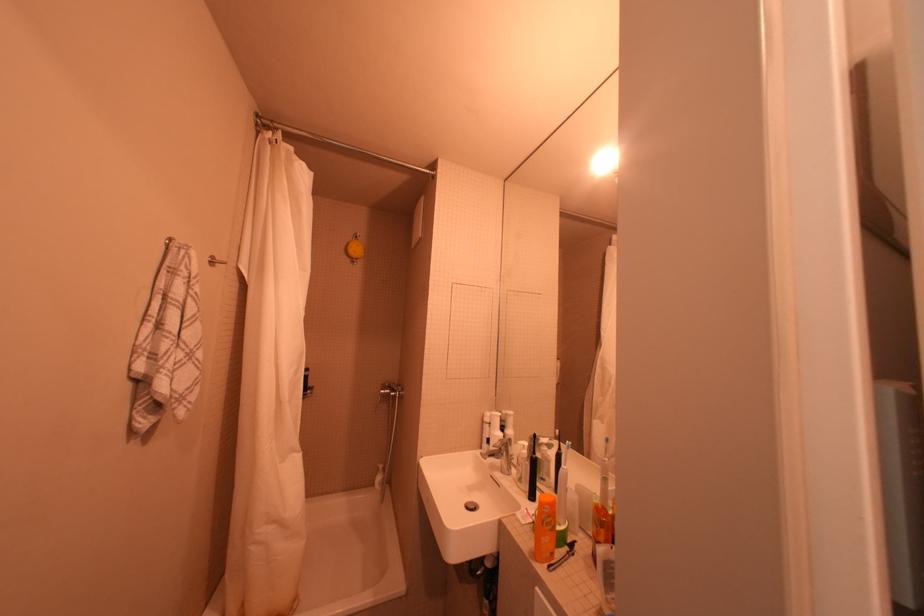
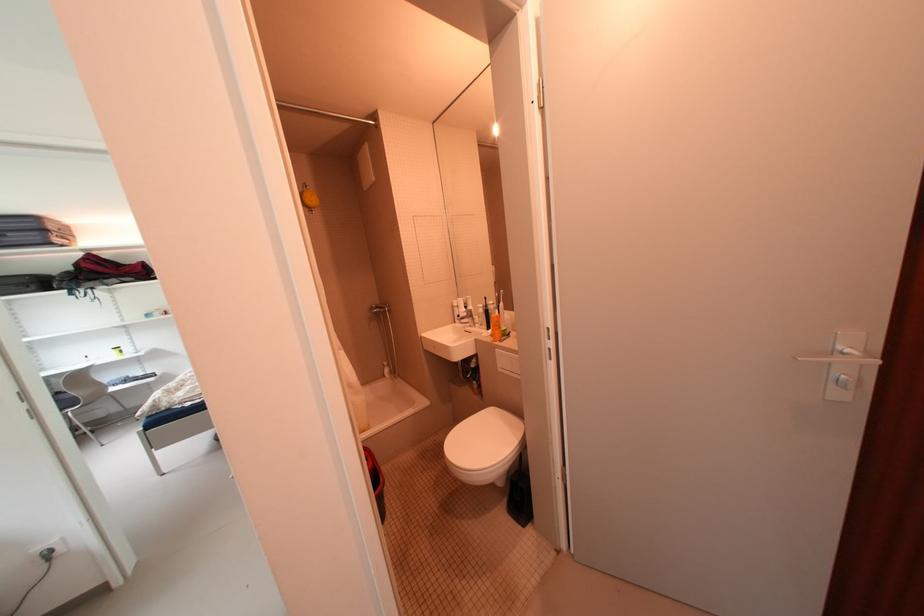
The point at (359, 248) is marked in the first image. Where is the corresponding point in the second image?

(314, 198)